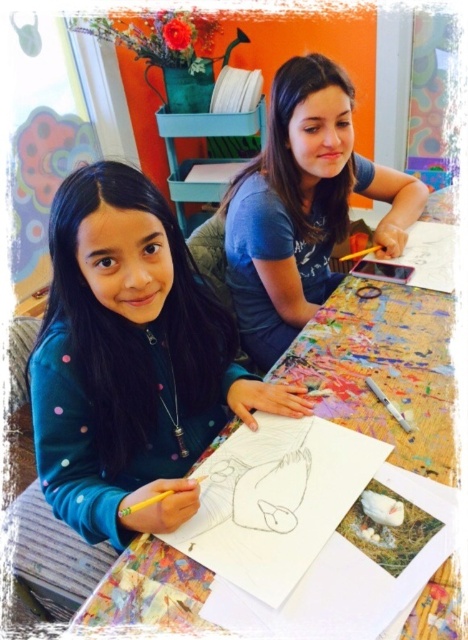
You are standing in front of the art studio table. There are two points marked on the table surface. The first point is at coordinates point (x=180, y=330) and the second is at point (x=350, y=180). Which point is closer to you?

The point at coordinates point (x=180, y=330) is closer to the viewer than point (x=350, y=180).

You are an artist who needs to place a large canvas on the teal fleece jacket at lower left and the wooden table at center. Which surface can accommodate the canvas better?

The wooden table at center can accommodate the canvas better since the teal fleece jacket at lower left occupies less space than the wooden table at center, making it insufficient for holding a large canvas.

You are standing at the back of the art classroom and want to reach the two points on the table. Which point, point [133,394] or point [343,394], is closer to you?

Point [343,394] is closer to you because it is behind point [133,394].